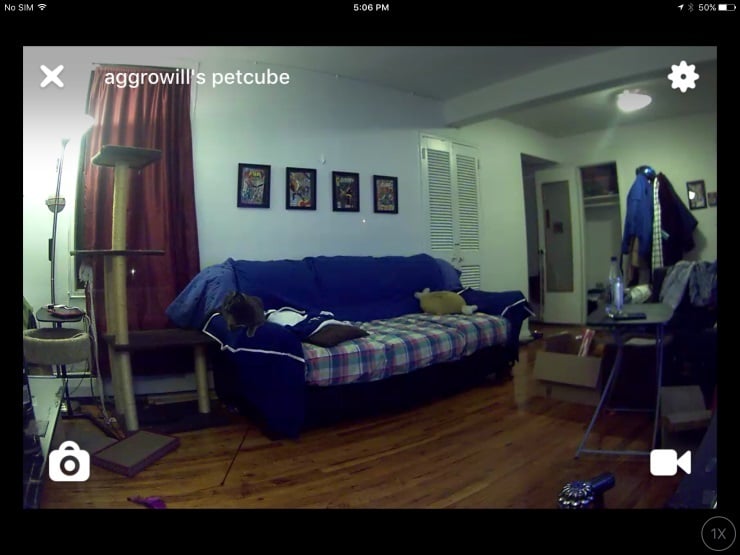
The image size is (740, 555). In order to click on open closet with in this screenshot , I will do `click(613, 227)`.